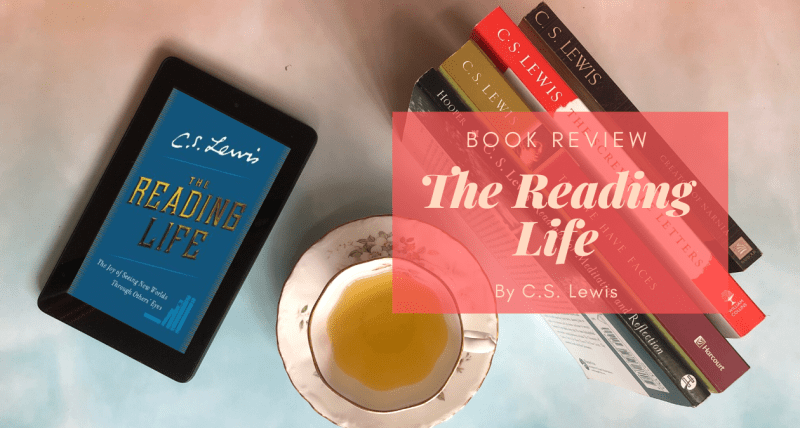
What are the coordinates of `teacup` in the screenshot? It's located at (333, 287).